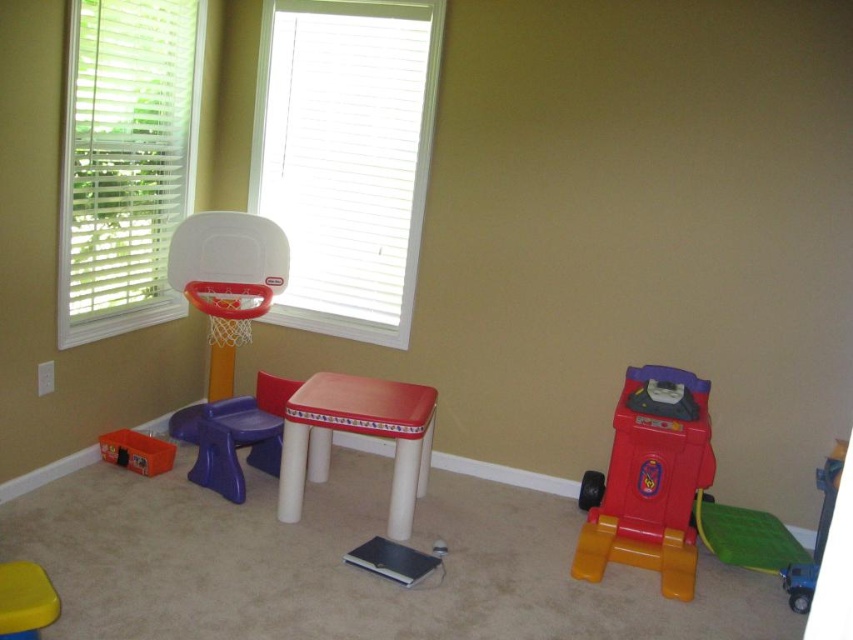
From the picture: Who is higher up, yellow plastic stool at lower left or blue plastic toy car at lower right?

Positioned higher is yellow plastic stool at lower left.

Image resolution: width=853 pixels, height=640 pixels. Describe the element at coordinates (25, 600) in the screenshot. I see `yellow plastic stool at lower left` at that location.

Does point (16, 573) lie behind point (811, 596)?

No, (16, 573) is in front of (811, 596).

I want to click on yellow plastic stool at lower left, so click(25, 600).

Is rubberized plastic toy car at right smaller than orange plastic toy at lower left?

Actually, rubberized plastic toy car at right might be larger than orange plastic toy at lower left.

Can you confirm if rubberized plastic toy car at right is bigger than orange plastic toy at lower left?

Correct, rubberized plastic toy car at right is larger in size than orange plastic toy at lower left.

This screenshot has height=640, width=853. What do you see at coordinates (650, 488) in the screenshot? I see `rubberized plastic toy car at right` at bounding box center [650, 488].

Where is `rubberized plastic toy car at right`? Image resolution: width=853 pixels, height=640 pixels. rubberized plastic toy car at right is located at coordinates (650, 488).

From the picture: Can you confirm if orange plastic toy at lower left is shorter than blue plastic toy car at lower right?

No, orange plastic toy at lower left is not shorter than blue plastic toy car at lower right.

Is point (171, 452) closer to camera compared to point (814, 564)?

That is False.

Where is `orange plastic toy at lower left`? Image resolution: width=853 pixels, height=640 pixels. orange plastic toy at lower left is located at coordinates (136, 451).